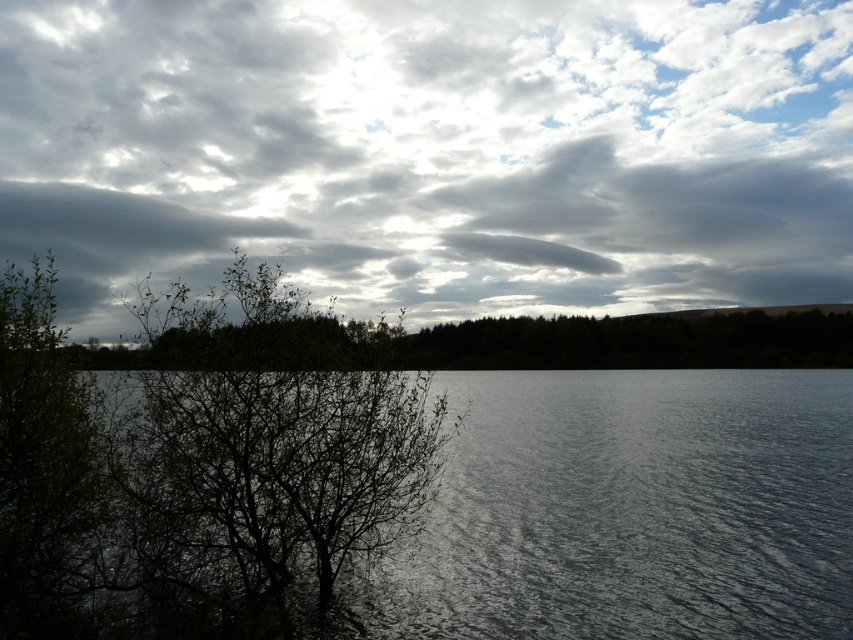
Question: Is green leafy tree at center to the left of green leafy tree at left from the viewer's perspective?

Choices:
 (A) no
 (B) yes

Answer: (A)

Question: Which is farther from the green leafy tree at center?

Choices:
 (A) cloudy sky at upper center
 (B) green leafy tree at left

Answer: (A)

Question: Does green leafy tree at center appear on the left side of green leafy tree at lower left?

Choices:
 (A) yes
 (B) no

Answer: (A)

Question: Which of the following is the farthest from the observer?

Choices:
 (A) cloudy sky at upper center
 (B) glossy water at lower left

Answer: (B)

Question: Can you confirm if cloudy sky at upper center is smaller than green leafy tree at center?

Choices:
 (A) yes
 (B) no

Answer: (B)

Question: Based on their relative distances, which object is farther from the green leafy tree at center?

Choices:
 (A) glossy water at lower left
 (B) green leafy tree at left

Answer: (A)